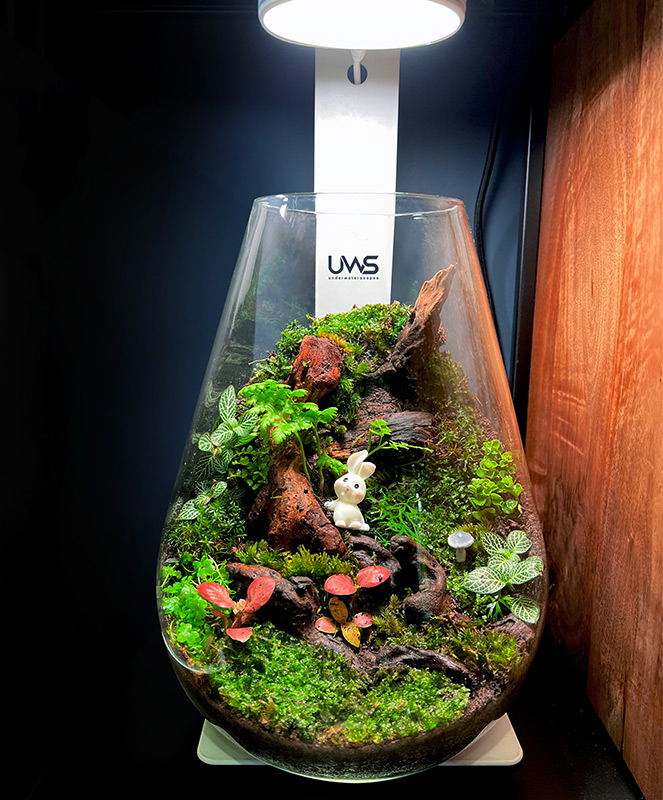
In order to click on bunny figurine in this screenshot , I will do `click(347, 504)`.